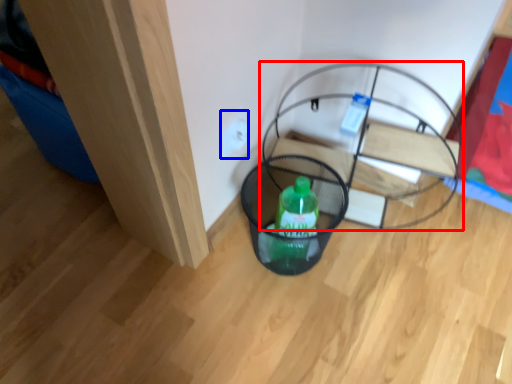
Question: Which point is further to the camera, furniture (highlighted by a red box) or electric outlet (highlighted by a blue box)?

Choices:
 (A) furniture
 (B) electric outlet

Answer: (B)